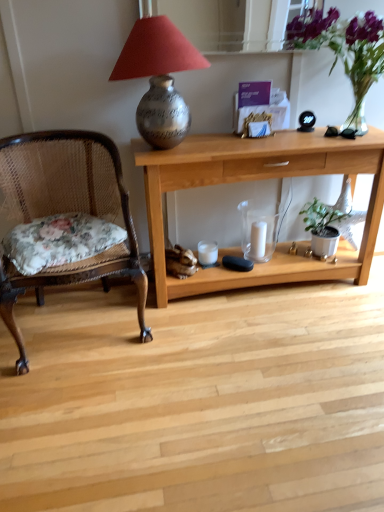
Question: Considering the relative sizes of green matte plant at lower right and silver textured vase at upper center in the image provided, is green matte plant at lower right smaller than silver textured vase at upper center?

Choices:
 (A) no
 (B) yes

Answer: (B)

Question: Can you confirm if green matte plant at lower right is shorter than silver textured vase at upper center?

Choices:
 (A) no
 (B) yes

Answer: (B)

Question: From a real-world perspective, does green matte plant at lower right stand above silver textured vase at upper center?

Choices:
 (A) no
 (B) yes

Answer: (A)

Question: Is green matte plant at lower right not inside silver textured vase at upper center?

Choices:
 (A) yes
 (B) no

Answer: (A)

Question: From the image's perspective, is green matte plant at lower right beneath silver textured vase at upper center?

Choices:
 (A) no
 (B) yes

Answer: (B)

Question: Does green matte plant at lower right have a greater height compared to silver textured vase at upper center?

Choices:
 (A) yes
 (B) no

Answer: (B)

Question: Considering the relative sizes of light wood desk at center and white matte candle at center in the image provided, is light wood desk at center thinner than white matte candle at center?

Choices:
 (A) no
 (B) yes

Answer: (A)

Question: From a real-world perspective, is light wood desk at center physically below white matte candle at center?

Choices:
 (A) yes
 (B) no

Answer: (B)

Question: Is light wood desk at center with white matte candle at center?

Choices:
 (A) no
 (B) yes

Answer: (A)

Question: Would you say light wood desk at center is outside white matte candle at center?

Choices:
 (A) yes
 (B) no

Answer: (A)

Question: Does light wood desk at center have a smaller size compared to white matte candle at center?

Choices:
 (A) no
 (B) yes

Answer: (A)

Question: Is light wood desk at center bigger than white matte candle at center?

Choices:
 (A) yes
 (B) no

Answer: (A)

Question: Can we say white matte candle at center lies outside woven wood chair with floral cushion at left?

Choices:
 (A) yes
 (B) no

Answer: (A)